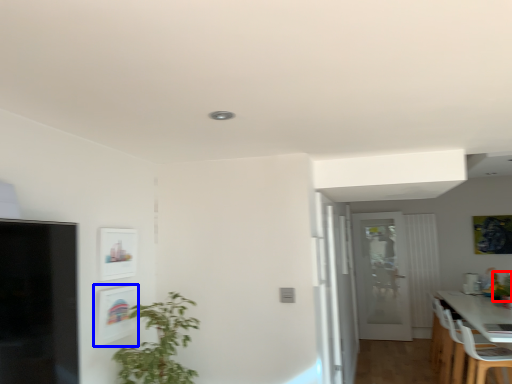
Question: Which object appears farthest to the camera in this image, plant (highlighted by a red box) or picture frame (highlighted by a blue box)?

Choices:
 (A) plant
 (B) picture frame

Answer: (A)